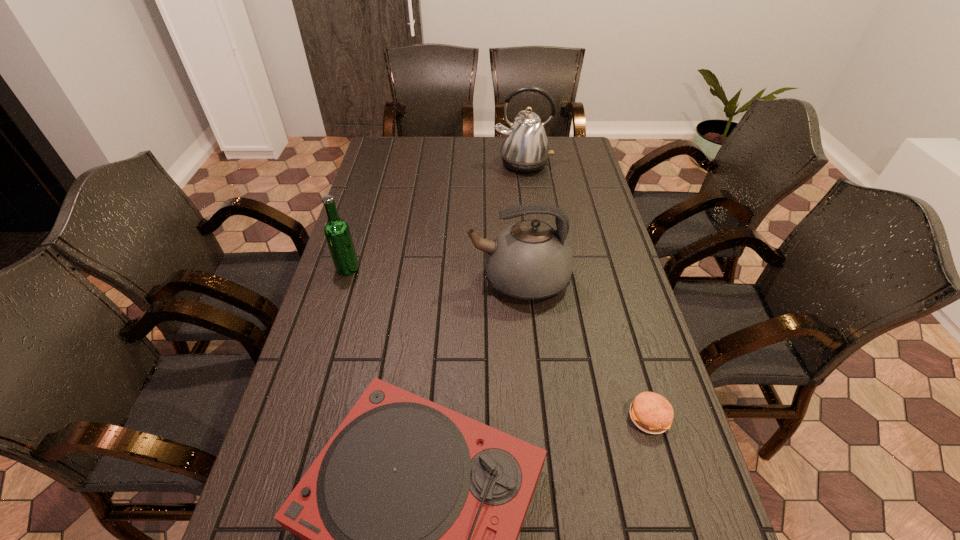
What are the coordinates of `unoccupied area between the nearer kettle and the beer bottle` in the screenshot? It's located at (433, 274).

The image size is (960, 540). Find the location of `vacant space in between the shorter kettle and the rightmost object`. vacant space in between the shorter kettle and the rightmost object is located at coordinates (584, 348).

Locate an element on the screen. The image size is (960, 540). free space between the leftmost object and the farthest object is located at coordinates (435, 216).

Identify the location of free space between the shorter kettle and the beer bottle. This screenshot has height=540, width=960. (433, 274).

Locate an element on the screen. This screenshot has height=540, width=960. free space that is in between the beer bottle and the nearer kettle is located at coordinates (433, 274).

Identify the location of vacant space that's between the leftmost object and the shortest object. This screenshot has width=960, height=540. (498, 342).

Locate an element on the screen. the third closest object to the hamburger is located at coordinates (337, 232).

At what (x,y) coordinates should I click in order to perform the action: click on the third closest object to the second shortest object. Please return your answer as a coordinate pair (x, y). Looking at the image, I should click on (337, 232).

Where is `free space that satisfies the following two spatial constraints: 1. from the spout of the rightmost object; 2. on the left side of the farthest object`? free space that satisfies the following two spatial constraints: 1. from the spout of the rightmost object; 2. on the left side of the farthest object is located at coordinates (556, 417).

Locate an element on the screen. Image resolution: width=960 pixels, height=540 pixels. free space that satisfies the following two spatial constraints: 1. from the spout of the farther kettle; 2. at the spout of the nearer kettle is located at coordinates (538, 280).